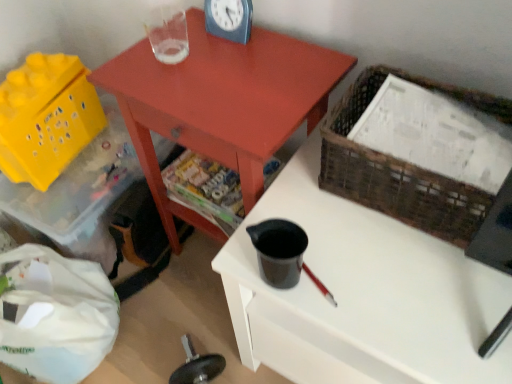
Where is `vacant space to the left of blue plastic clock at upper center`? This screenshot has width=512, height=384. vacant space to the left of blue plastic clock at upper center is located at coordinates (169, 46).